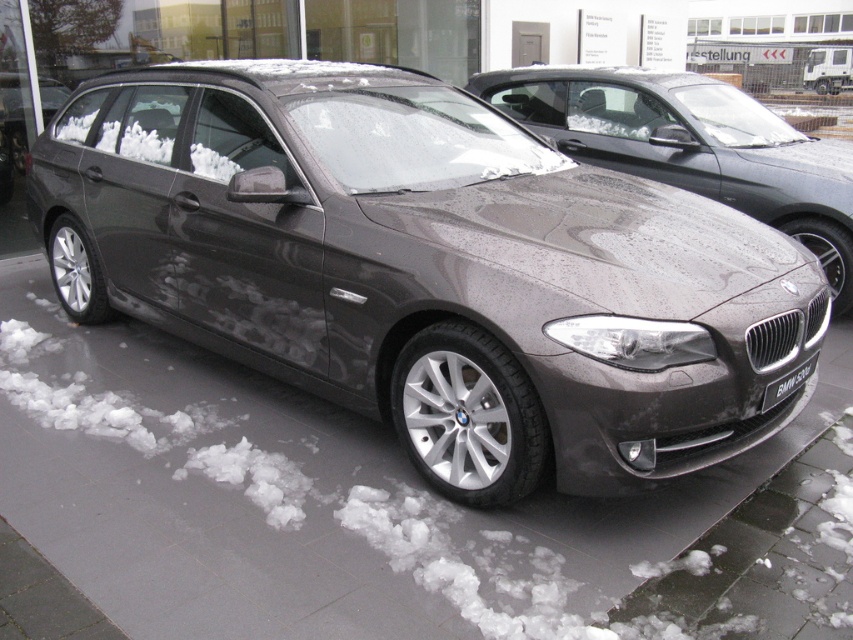
You are standing in a car showroom and want to place a decorative mat between the gray concrete pavement at center and the black plastic license plate at center. Which object should the mat be placed closer to the viewer compared to the other?

The gray concrete pavement at center is closer to the viewer than the black plastic license plate at center, so the mat should be placed closer to the gray concrete pavement at center.

You are a delivery person trying to park a small delivery van next to the satin metallic car at center and the gray concrete pavement at center. Considering the size difference between the two, which object would require more space to accommodate the van?

The satin metallic car at center is larger than the gray concrete pavement at center, so it would require more space to accommodate the van.